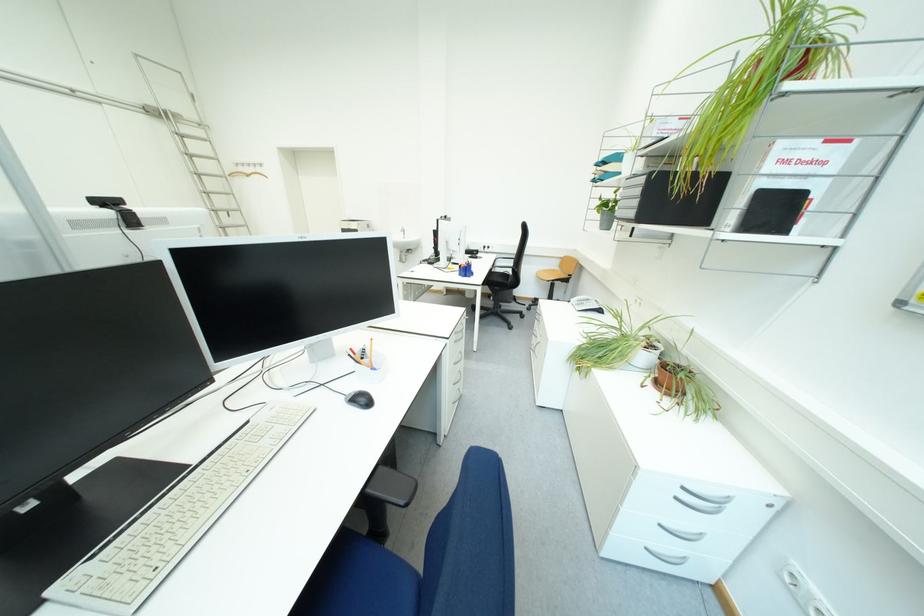
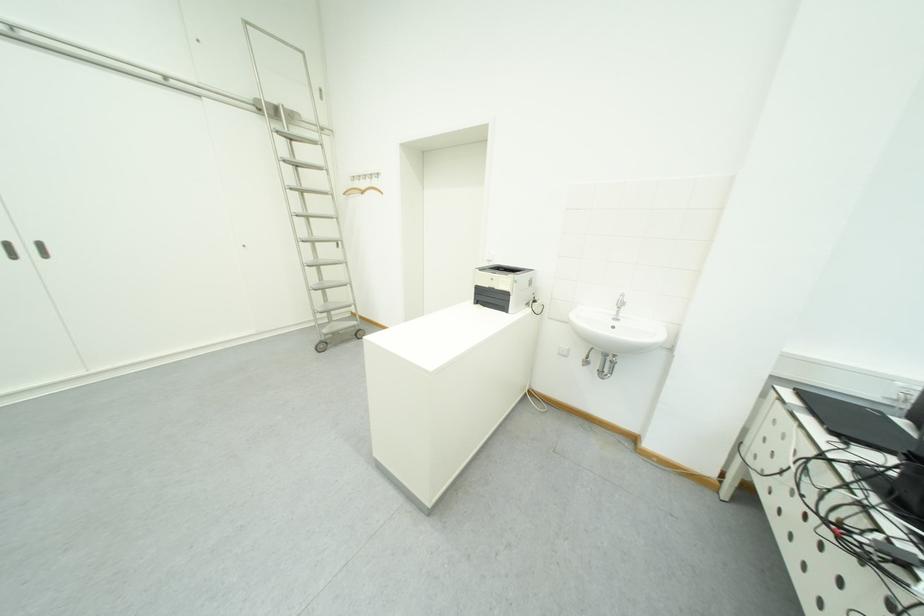
Where in the second image is the point corresponding to [221,191] from the first image?

(322, 213)